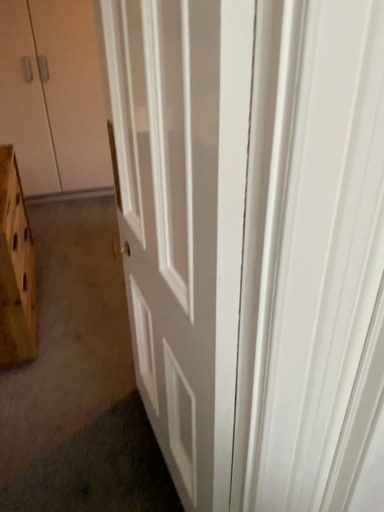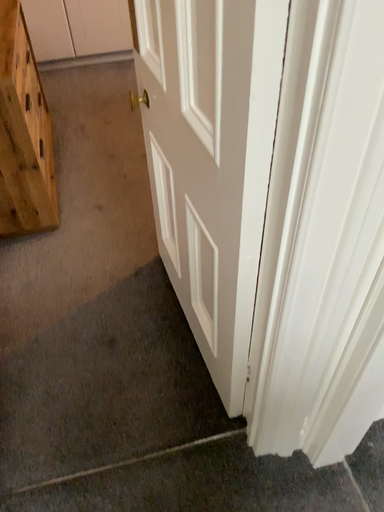
Question: How did the camera likely rotate when shooting the video?

Choices:
 (A) rotated downward
 (B) rotated upward

Answer: (A)